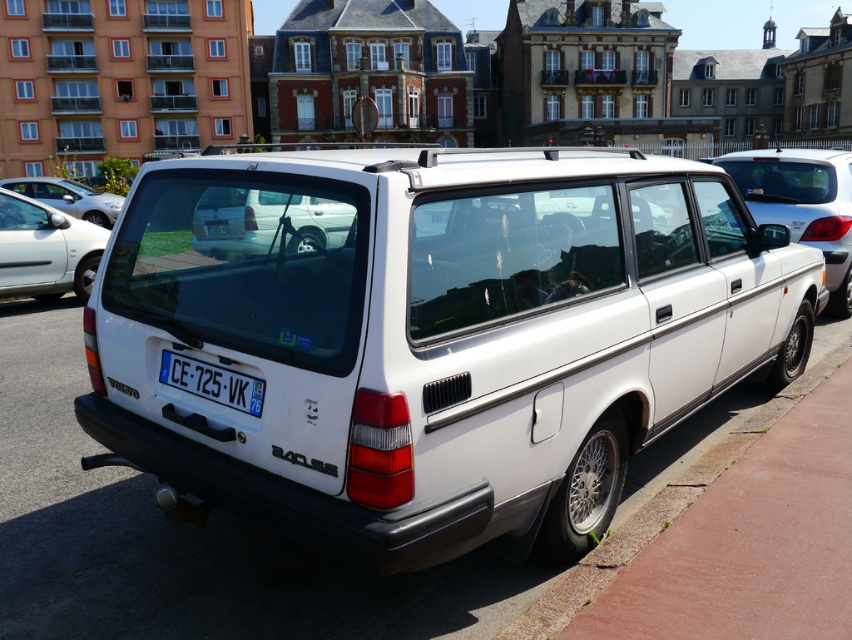
Can you confirm if white matte car at upper left is smaller than white matte hatchback at upper left?

Correct, white matte car at upper left occupies less space than white matte hatchback at upper left.

Which is in front, point (9, 268) or point (49, 179)?

Point (9, 268) is more forward.

Is point (38, 256) positioned before point (4, 182)?

Yes.

This screenshot has height=640, width=852. In order to click on white matte car at upper left in this screenshot , I will do `click(45, 250)`.

Which is behind, point (206, 385) or point (217, 225)?

Point (217, 225)

Is white plastic license plate at center below white plastic license plate at rear?

Yes.

Locate an element on the screen. Image resolution: width=852 pixels, height=640 pixels. white plastic license plate at center is located at coordinates (213, 381).

At what (x,y) coordinates should I click in order to perform the action: click on white plastic license plate at center. Please return your answer as a coordinate pair (x, y). Looking at the image, I should click on (213, 381).

Does white matte van at center have a lesser height compared to white matte hatchback at upper left?

Yes, white matte van at center is shorter than white matte hatchback at upper left.

Does point (233, 252) come farther from viewer compared to point (20, 193)?

No.

Is point (347, 243) closer to viewer compared to point (22, 180)?

Yes.

In order to click on white matte van at center in this screenshot , I will do `click(269, 221)`.